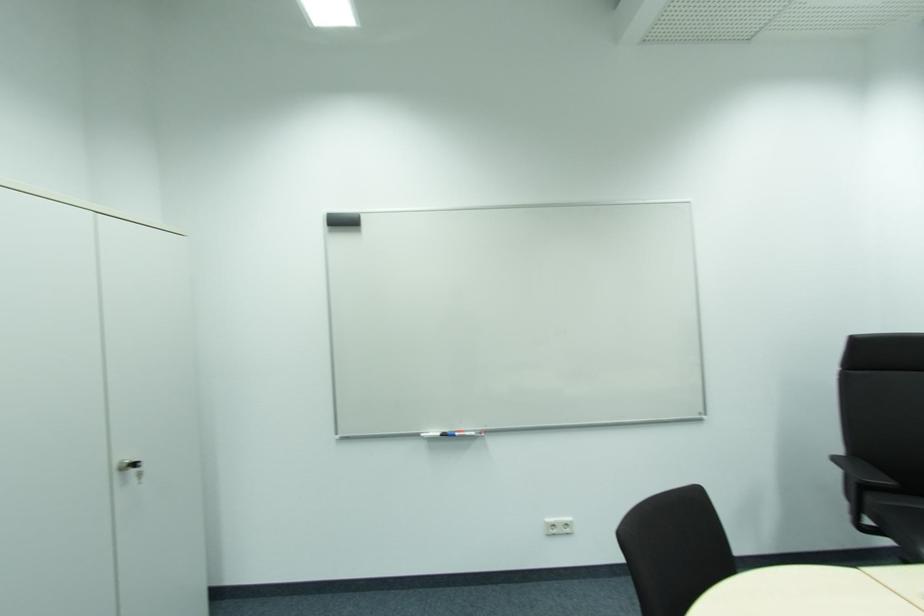
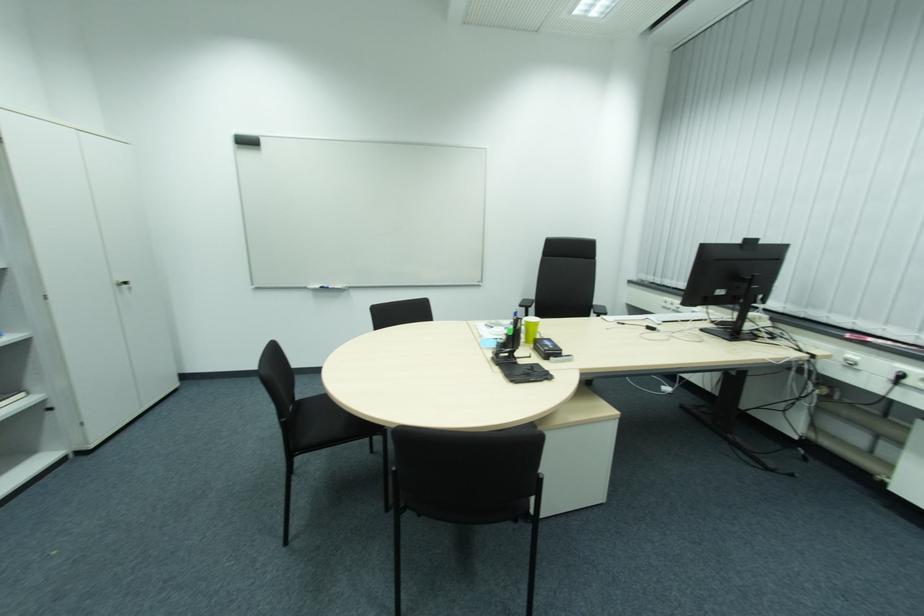
The point at (x=120, y=474) is marked in the first image. Where is the corresponding point in the second image?

(122, 286)